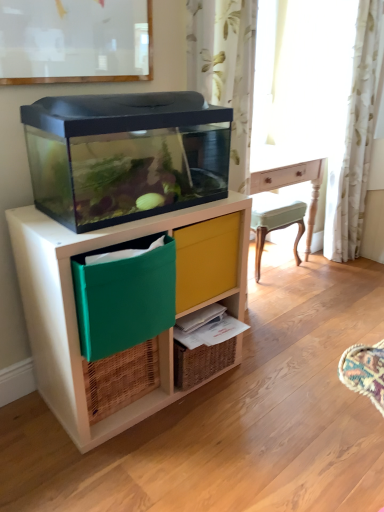
Locate an element on the screen. The image size is (384, 512). free space in front of white floral fabric curtain at right is located at coordinates (347, 269).